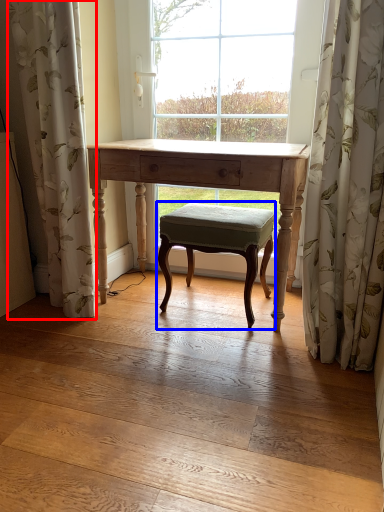
Question: Which object is closer to the camera taking this photo, curtain (highlighted by a red box) or stool (highlighted by a blue box)?

Choices:
 (A) curtain
 (B) stool

Answer: (A)